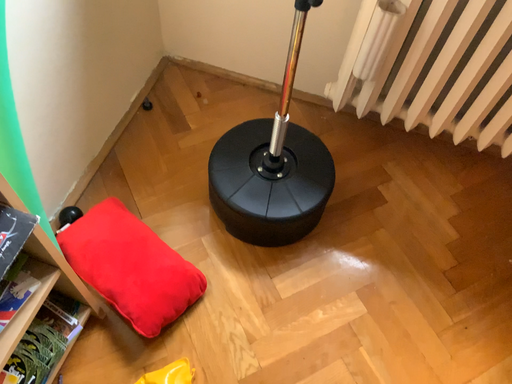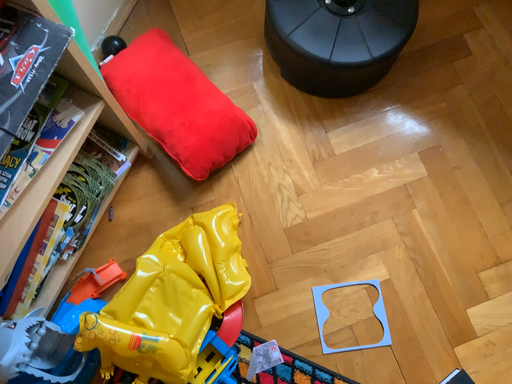
Question: Which way did the camera rotate in the video?

Choices:
 (A) rotated left
 (B) rotated right

Answer: (A)